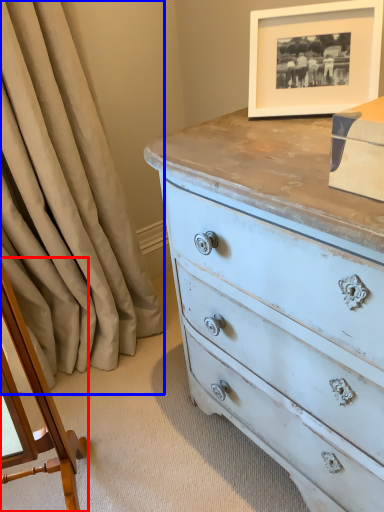
Question: Which of the following is the closest to the observer, changing table (highlighted by a red box) or curtain (highlighted by a blue box)?

Choices:
 (A) changing table
 (B) curtain

Answer: (A)